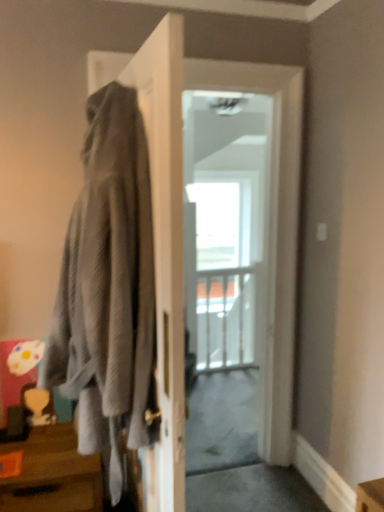
Question: Is brown wood table at lower left facing away from gray textured hoodie at left?

Choices:
 (A) no
 (B) yes

Answer: (A)

Question: Considering the relative sizes of brown wood table at lower left and gray textured hoodie at left in the image provided, is brown wood table at lower left taller than gray textured hoodie at left?

Choices:
 (A) no
 (B) yes

Answer: (A)

Question: Is brown wood table at lower left wider than gray textured hoodie at left?

Choices:
 (A) yes
 (B) no

Answer: (A)

Question: Is brown wood table at lower left next to gray textured hoodie at left?

Choices:
 (A) no
 (B) yes

Answer: (A)

Question: From a real-world perspective, is brown wood table at lower left beneath gray textured hoodie at left?

Choices:
 (A) yes
 (B) no

Answer: (A)

Question: Is white glossy door at center to the left or to the right of brown wood table at lower left in the image?

Choices:
 (A) right
 (B) left

Answer: (A)

Question: Relative to brown wood table at lower left, is white glossy door at center in front or behind?

Choices:
 (A) front
 (B) behind

Answer: (B)

Question: Is point (168, 184) closer or farther from the camera than point (16, 502)?

Choices:
 (A) farther
 (B) closer

Answer: (B)

Question: From the image's perspective, is white glossy door at center located above or below brown wood table at lower left?

Choices:
 (A) above
 (B) below

Answer: (A)

Question: From a real-world perspective, is transparent glass door at center positioned above or below white glossy door at center?

Choices:
 (A) above
 (B) below

Answer: (B)

Question: Is transparent glass door at center inside or outside of white glossy door at center?

Choices:
 (A) outside
 (B) inside

Answer: (A)

Question: Considering the positions of point (205, 332) and point (158, 261), is point (205, 332) closer or farther from the camera than point (158, 261)?

Choices:
 (A) farther
 (B) closer

Answer: (A)

Question: Considering their positions, is transparent glass door at center located in front of or behind white glossy door at center?

Choices:
 (A) behind
 (B) front

Answer: (A)

Question: From their relative heights in the image, would you say transparent glass door at center is taller or shorter than gray textured hoodie at left?

Choices:
 (A) tall
 (B) short

Answer: (A)

Question: In terms of size, does transparent glass door at center appear bigger or smaller than gray textured hoodie at left?

Choices:
 (A) small
 (B) big

Answer: (A)